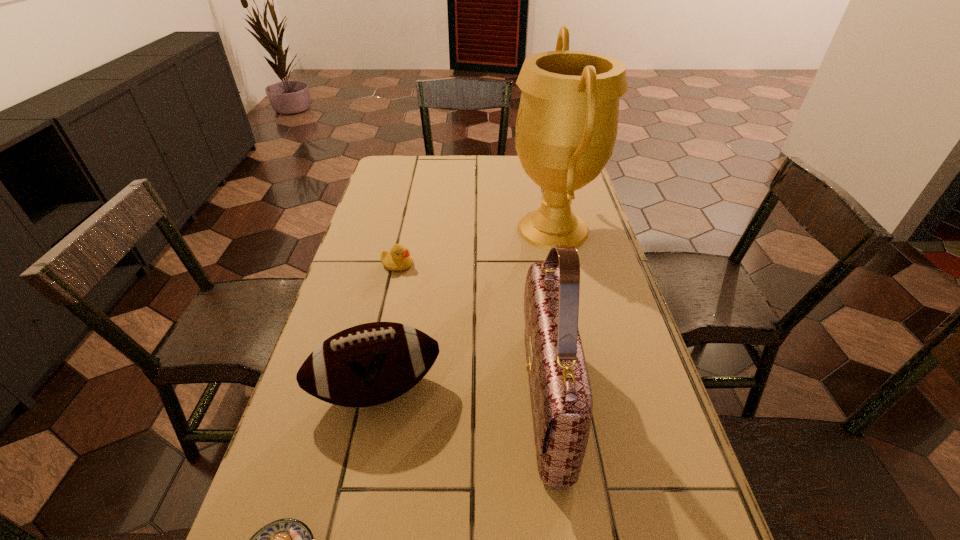
Locate which object ranks second in proximity to the second shortest object. Please provide its 2D coordinates. Your answer should be formatted as a tuple, i.e. [(x, y)], where the tuple contains the x and y coordinates of a point satisfying the conditions above.

[(369, 364)]

Find the location of a particular element. object that ranks as the second closest to the football (American) is located at coordinates (288, 539).

At what (x,y) coordinates should I click in order to perform the action: click on vacant space that satisfies the following two spatial constraints: 1. at the face of the football (American); 2. on the right side of the duckling. Please return your answer as a coordinate pair (x, y). Image resolution: width=960 pixels, height=540 pixels. Looking at the image, I should click on [370, 389].

The width and height of the screenshot is (960, 540). Identify the location of vacant space that satisfies the following two spatial constraints: 1. at the face of the third shortest object; 2. on the right side of the second shortest object. (370, 389).